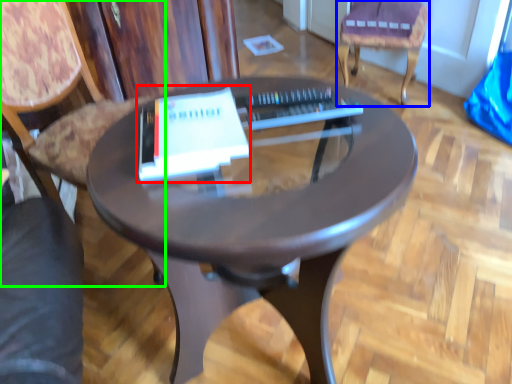
Question: Considering the real-world distances, which object is farthest from paperback book (highlighted by a red box)? chair (highlighted by a blue box) or chair (highlighted by a green box)?

Choices:
 (A) chair
 (B) chair

Answer: (A)